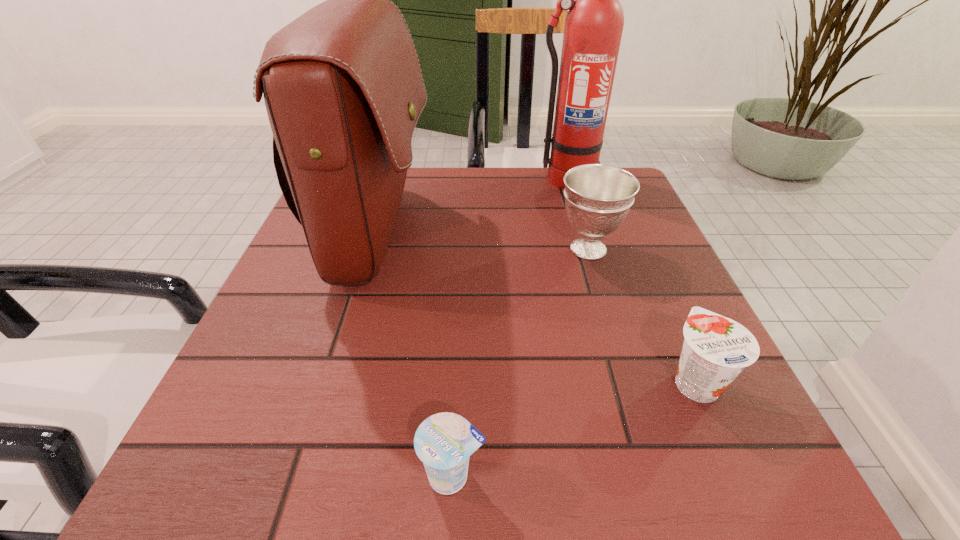
Where is `object present at the far right corner`? The width and height of the screenshot is (960, 540). object present at the far right corner is located at coordinates (594, 23).

In the image, there is a desktop. Where is `free space at the far edge`? free space at the far edge is located at coordinates (453, 174).

This screenshot has height=540, width=960. Identify the location of free spot at the near edge of the desktop. (503, 442).

Where is `vacant space at the left edge of the desktop`? The height and width of the screenshot is (540, 960). vacant space at the left edge of the desktop is located at coordinates (320, 347).

In the image, there is a desktop. Identify the location of free region at the right edge. (662, 256).

Identify the location of empty space that is in between the fire extinguisher and the second nearest object. (630, 280).

Locate an element on the screen. This screenshot has width=960, height=540. free space between the nearest object and the chalice is located at coordinates (520, 362).

At what (x,y) coordinates should I click in order to perform the action: click on vacant point located between the fire extinguisher and the second nearest object. Please return your answer as a coordinate pair (x, y). This screenshot has height=540, width=960. Looking at the image, I should click on (630, 280).

Image resolution: width=960 pixels, height=540 pixels. I want to click on vacant space in between the fourth farthest object and the leftmost object, so click(537, 307).

The image size is (960, 540). In order to click on free space between the chalice and the farther yogurt in this screenshot , I will do `click(641, 315)`.